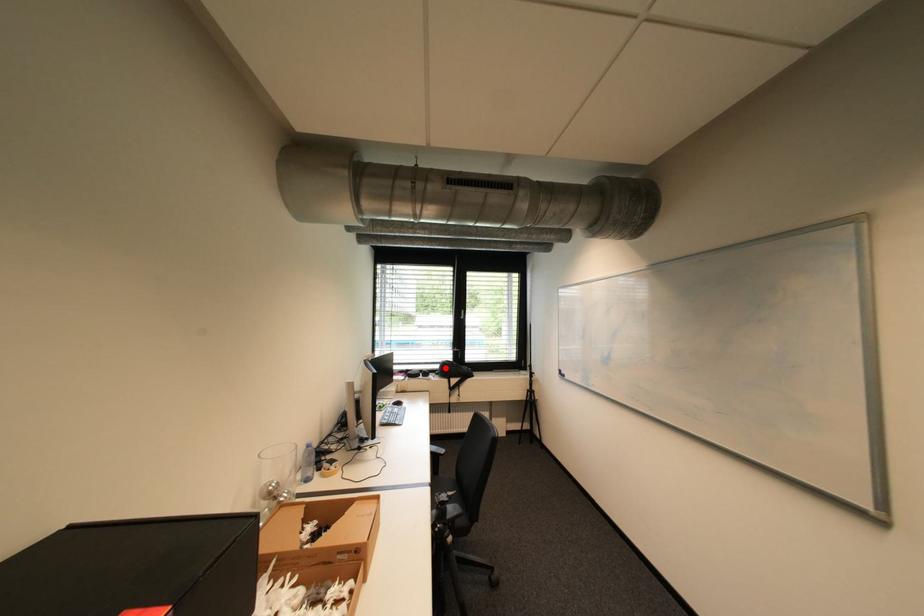
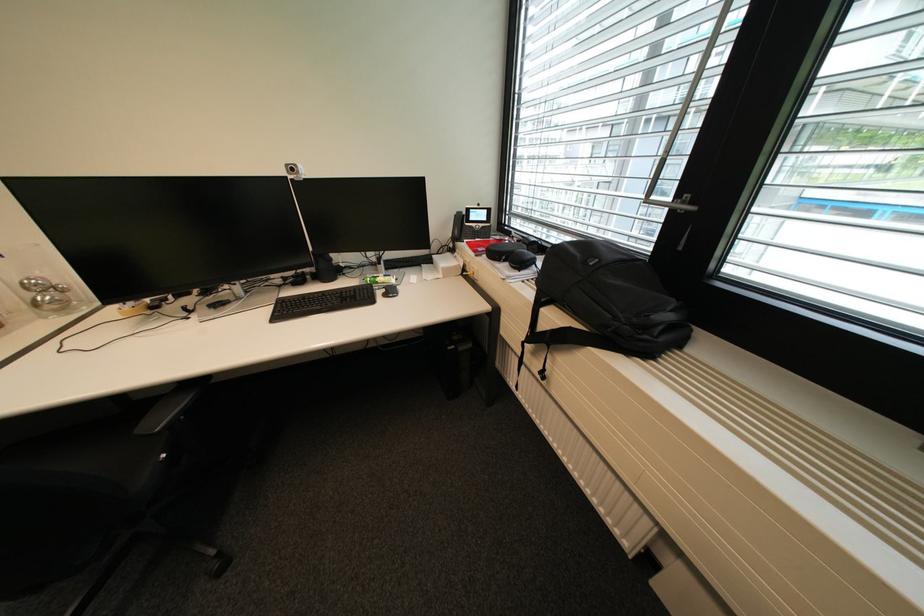
Question: I am providing you with two images of the same scene from different viewpoints. A red point is marked on the first image. Is the red point's position out of view in image 2?

Choices:
 (A) Yes
 (B) No

Answer: (A)